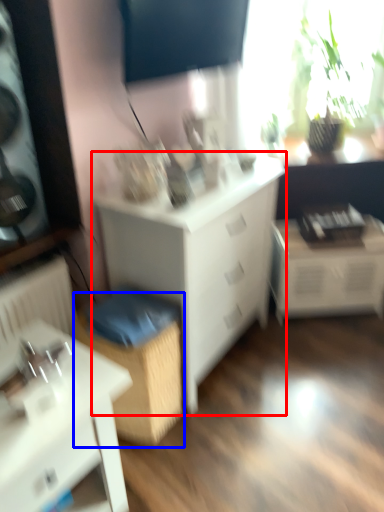
Question: Among these objects, which one is farthest to the camera, chest of drawers (highlighted by a red box) or cabinetry (highlighted by a blue box)?

Choices:
 (A) chest of drawers
 (B) cabinetry

Answer: (B)